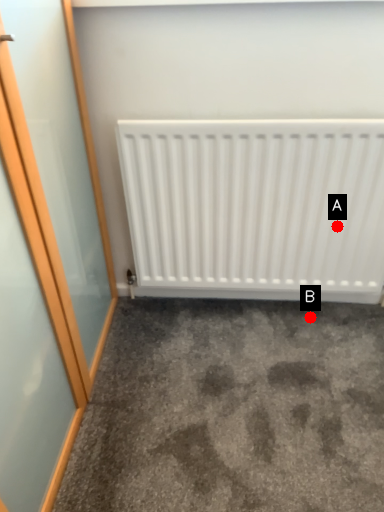
Question: Two points are circled on the image, labeled by A and B beside each circle. Which point appears closest to the camera in this image?

Choices:
 (A) A is closer
 (B) B is closer

Answer: (A)